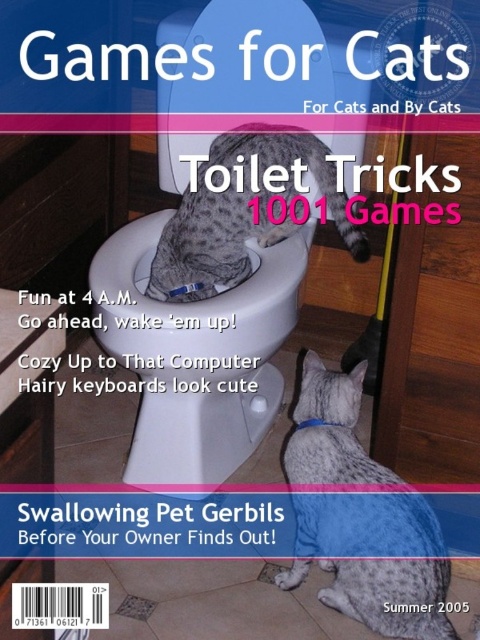
Is point (315, 40) farther from viewer compared to point (321, 598)?

Yes, it is behind point (321, 598).

Does white glossy toilet bowl at center have a lesser width compared to gray spotted fur at lower right?

Incorrect, white glossy toilet bowl at center's width is not less than gray spotted fur at lower right's.

Who is more forward, (240, 372) or (343, 566)?

Point (343, 566)

You are a GUI agent. You are given a task and a screenshot of the screen. Output one action in this format:
    pyautogui.click(x=<x>, y=<y>)
    Task: Click on the white glossy toilet bowl at center
    The height and width of the screenshot is (640, 480).
    Given the screenshot: What is the action you would take?
    pyautogui.click(x=202, y=346)

How far apart are white glossy toilet bowl at center and spotted fur cat at center?

The distance of white glossy toilet bowl at center from spotted fur cat at center is 3.19 inches.

Looking at this image, is the position of white glossy toilet bowl at center less distant than that of spotted fur cat at center?

Yes.

The width and height of the screenshot is (480, 640). Identify the location of white glossy toilet bowl at center. (202, 346).

Measure the distance between spotted fur cat at center and camera.

1.51 meters

Does point (362, 232) lie in front of point (412, 577)?

No.

Between point (204, 280) and point (356, 582), which one is positioned in front?

Point (356, 582) is more forward.

Where is `spotted fur cat at center`? The width and height of the screenshot is (480, 640). spotted fur cat at center is located at coordinates (243, 211).